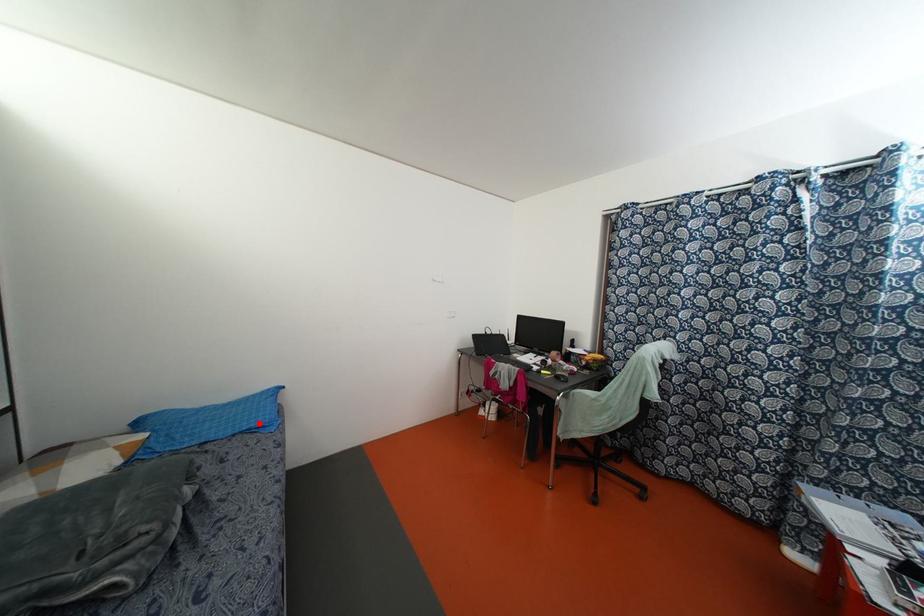
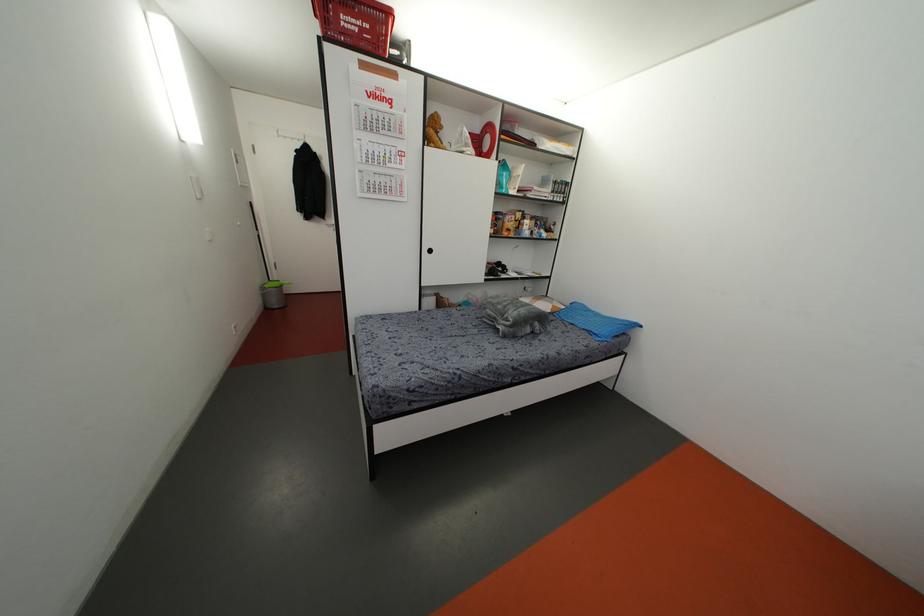
Question: I am providing you with two images of the same scene from different viewpoints. Given a red point in image1, look at the same physical point in image2. Is it:

Choices:
 (A) Closer to the viewpoint
 (B) Farther from the viewpoint

Answer: (B)